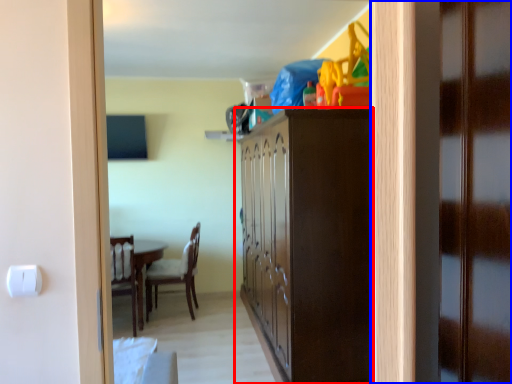
Question: Which object is closer to the camera taking this photo, cabinetry (highlighted by a red box) or door (highlighted by a blue box)?

Choices:
 (A) cabinetry
 (B) door

Answer: (B)